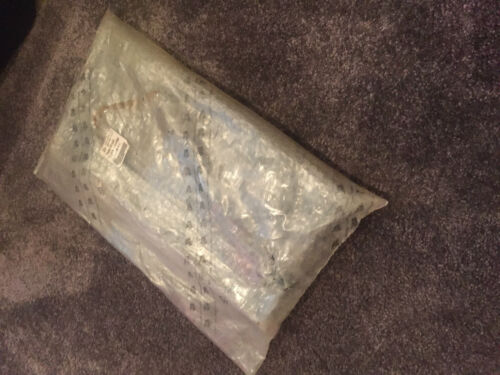
Locate an element on the screen. This screenshot has width=500, height=375. carpet to right of package is located at coordinates click(x=348, y=288).